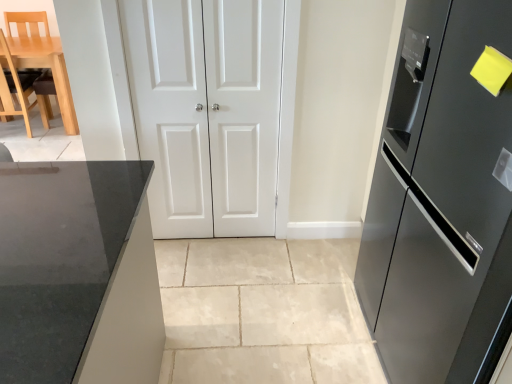
Find the location of a particular element. The image size is (512, 384). vacant area on top of white glossy door at center, which is counted as the 2th door, starting from the right (from a real-world perspective) is located at coordinates [x=204, y=0].